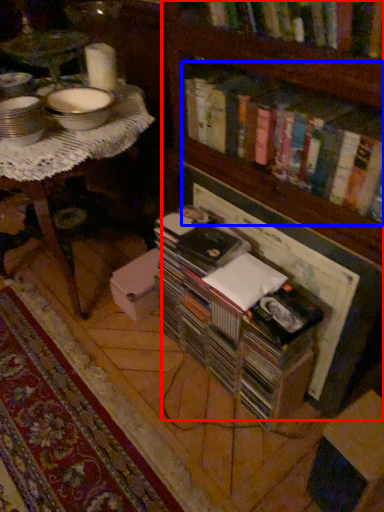
Question: Which object is further to the camera taking this photo, bookcase (highlighted by a red box) or book (highlighted by a blue box)?

Choices:
 (A) bookcase
 (B) book

Answer: (B)